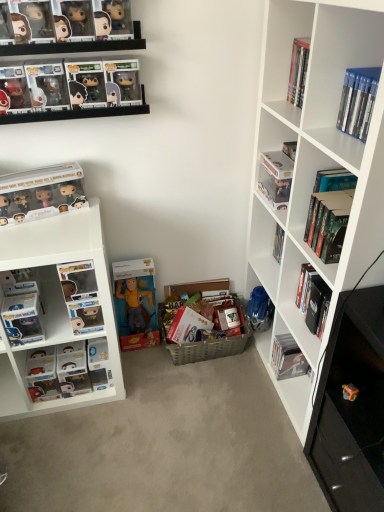
Where is `vacant region in front of woven brown basket at center`? The width and height of the screenshot is (384, 512). vacant region in front of woven brown basket at center is located at coordinates (212, 390).